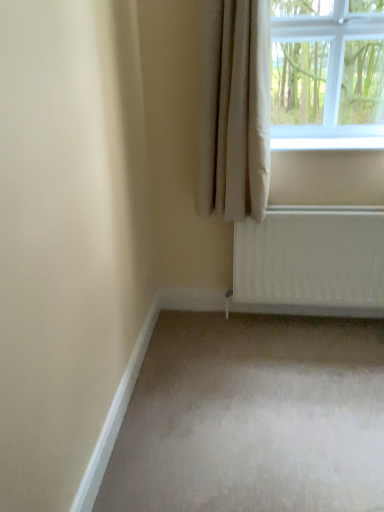
Question: Can you confirm if white plastic window sill at upper right is positioned to the right of white glass window at upper right?

Choices:
 (A) yes
 (B) no

Answer: (A)

Question: Is white plastic window sill at upper right directly adjacent to white glass window at upper right?

Choices:
 (A) no
 (B) yes

Answer: (A)

Question: Can you confirm if white plastic window sill at upper right is smaller than white glass window at upper right?

Choices:
 (A) yes
 (B) no

Answer: (A)

Question: Can you confirm if white plastic window sill at upper right is thinner than white glass window at upper right?

Choices:
 (A) no
 (B) yes

Answer: (B)

Question: Is white plastic window sill at upper right facing towards white glass window at upper right?

Choices:
 (A) yes
 (B) no

Answer: (B)

Question: In terms of size, does beige fabric curtain at upper right appear bigger or smaller than white plastic window sill at upper right?

Choices:
 (A) small
 (B) big

Answer: (B)

Question: Does point (238, 206) appear closer or farther from the camera than point (344, 146)?

Choices:
 (A) farther
 (B) closer

Answer: (B)

Question: Is beige fabric curtain at upper right to the left or to the right of white plastic window sill at upper right in the image?

Choices:
 (A) left
 (B) right

Answer: (A)

Question: In terms of height, does beige fabric curtain at upper right look taller or shorter compared to white plastic window sill at upper right?

Choices:
 (A) tall
 (B) short

Answer: (A)

Question: From the image's perspective, relative to white plastic window sill at upper right, is white glass window at upper right above or below?

Choices:
 (A) above
 (B) below

Answer: (A)

Question: In terms of size, does white glass window at upper right appear bigger or smaller than white plastic window sill at upper right?

Choices:
 (A) small
 (B) big

Answer: (B)

Question: Considering the positions of point (357, 53) and point (312, 138), is point (357, 53) closer or farther from the camera than point (312, 138)?

Choices:
 (A) farther
 (B) closer

Answer: (B)

Question: From their relative heights in the image, would you say white glass window at upper right is taller or shorter than white plastic window sill at upper right?

Choices:
 (A) short
 (B) tall

Answer: (B)

Question: In terms of size, does beige fabric curtain at upper right appear bigger or smaller than white glass window at upper right?

Choices:
 (A) big
 (B) small

Answer: (B)

Question: From the image's perspective, is beige fabric curtain at upper right located above or below white glass window at upper right?

Choices:
 (A) below
 (B) above

Answer: (A)